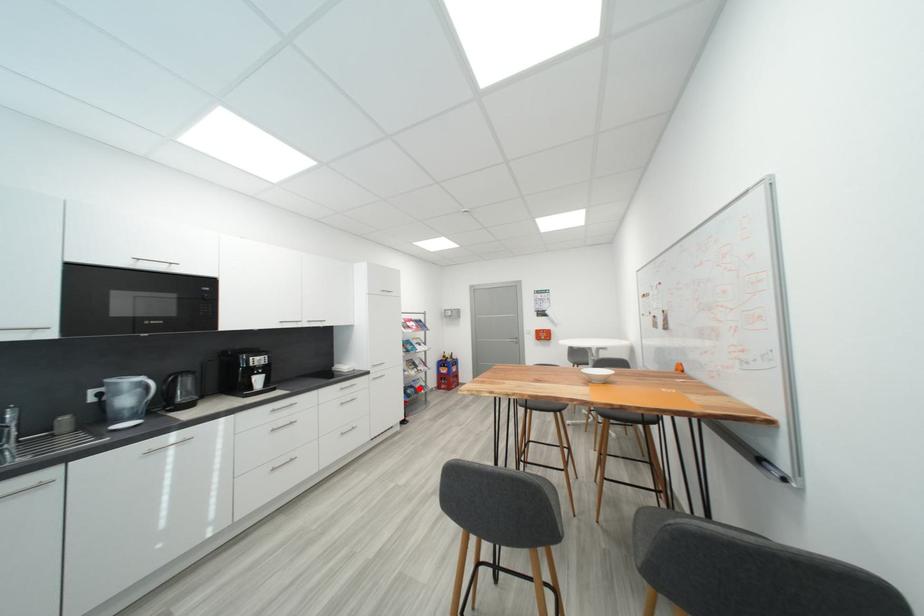
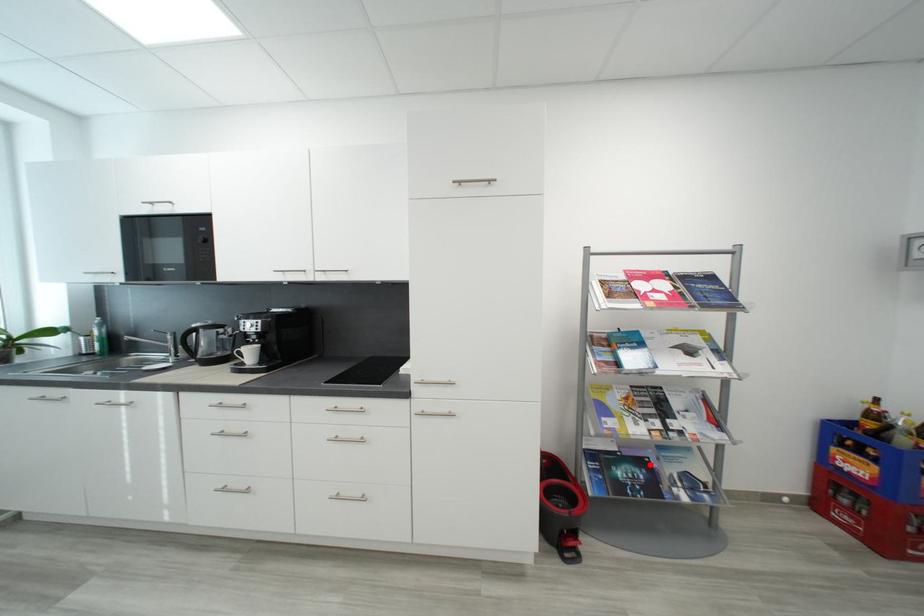
I am providing you with two images of the same scene from different viewpoints. A red point is marked on the first image and another point is marked on the second image. Is the marked point in image1 the same physical position as the marked point in image2?

Yes